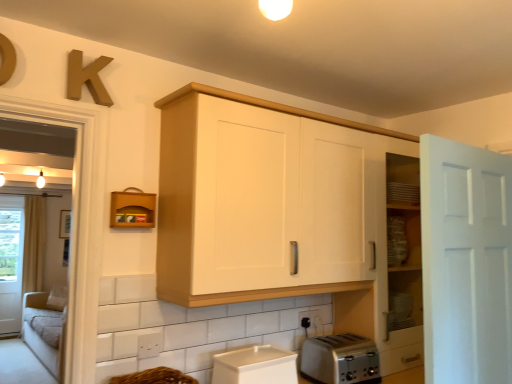
Question: Can you confirm if satin silver toaster at lower center is positioned to the left of brown leather shelf at upper left?

Choices:
 (A) no
 (B) yes

Answer: (A)

Question: Can you confirm if satin silver toaster at lower center is shorter than brown leather shelf at upper left?

Choices:
 (A) no
 (B) yes

Answer: (A)

Question: Can you confirm if satin silver toaster at lower center is bigger than brown leather shelf at upper left?

Choices:
 (A) yes
 (B) no

Answer: (A)

Question: Would you consider satin silver toaster at lower center to be distant from brown leather shelf at upper left?

Choices:
 (A) no
 (B) yes

Answer: (B)

Question: Can you confirm if satin silver toaster at lower center is taller than brown leather shelf at upper left?

Choices:
 (A) yes
 (B) no

Answer: (A)

Question: From a real-world perspective, is satin silver toaster at lower center physically above brown leather shelf at upper left?

Choices:
 (A) no
 (B) yes

Answer: (A)

Question: Can you confirm if brown woven basket at lower center is positioned to the left of wooden letter k at upper left?

Choices:
 (A) no
 (B) yes

Answer: (A)

Question: From a real-world perspective, is brown woven basket at lower center on top of wooden letter k at upper left?

Choices:
 (A) yes
 (B) no

Answer: (B)

Question: Is brown woven basket at lower center positioned with its back to wooden letter k at upper left?

Choices:
 (A) yes
 (B) no

Answer: (B)

Question: From a real-world perspective, is brown woven basket at lower center beneath wooden letter k at upper left?

Choices:
 (A) yes
 (B) no

Answer: (A)

Question: From the image's perspective, is brown woven basket at lower center located beneath wooden letter k at upper left?

Choices:
 (A) no
 (B) yes

Answer: (B)

Question: Considering the relative sizes of brown woven basket at lower center and wooden letter k at upper left in the image provided, is brown woven basket at lower center taller than wooden letter k at upper left?

Choices:
 (A) no
 (B) yes

Answer: (A)

Question: Considering the relative sizes of white matte door at right and black plastic electric outlet at lower center in the image provided, is white matte door at right shorter than black plastic electric outlet at lower center?

Choices:
 (A) yes
 (B) no

Answer: (B)